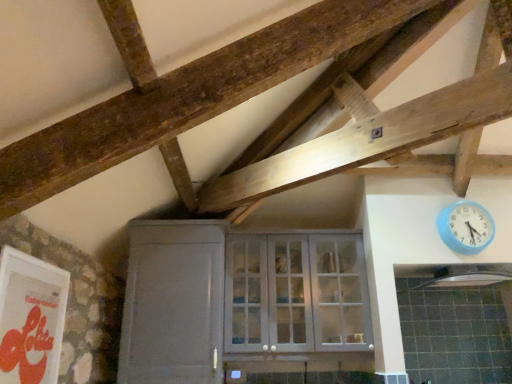
Question: From the image's perspective, does black matte exhaust hood at upper right appear higher than blue plastic wall clock at upper right?

Choices:
 (A) no
 (B) yes

Answer: (A)

Question: Can you confirm if black matte exhaust hood at upper right is smaller than blue plastic wall clock at upper right?

Choices:
 (A) yes
 (B) no

Answer: (B)

Question: Considering the relative sizes of black matte exhaust hood at upper right and blue plastic wall clock at upper right in the image provided, is black matte exhaust hood at upper right shorter than blue plastic wall clock at upper right?

Choices:
 (A) yes
 (B) no

Answer: (A)

Question: Is black matte exhaust hood at upper right behind blue plastic wall clock at upper right?

Choices:
 (A) yes
 (B) no

Answer: (B)

Question: Is black matte exhaust hood at upper right not near blue plastic wall clock at upper right?

Choices:
 (A) no
 (B) yes

Answer: (A)

Question: Could you tell me if black matte exhaust hood at upper right is turned towards blue plastic wall clock at upper right?

Choices:
 (A) yes
 (B) no

Answer: (B)

Question: Is white glass cabinet at center inside black matte exhaust hood at upper right?

Choices:
 (A) no
 (B) yes

Answer: (A)

Question: Can you confirm if black matte exhaust hood at upper right is shorter than white glass cabinet at center?

Choices:
 (A) yes
 (B) no

Answer: (A)

Question: Is black matte exhaust hood at upper right next to white glass cabinet at center?

Choices:
 (A) no
 (B) yes

Answer: (A)

Question: Is black matte exhaust hood at upper right facing towards white glass cabinet at center?

Choices:
 (A) yes
 (B) no

Answer: (B)

Question: From a real-world perspective, does black matte exhaust hood at upper right stand above white glass cabinet at center?

Choices:
 (A) yes
 (B) no

Answer: (A)

Question: From the image's perspective, is black matte exhaust hood at upper right on white glass cabinet at center?

Choices:
 (A) yes
 (B) no

Answer: (A)

Question: Does blue plastic wall clock at upper right have a larger size compared to white glass cabinet at center?

Choices:
 (A) no
 (B) yes

Answer: (A)